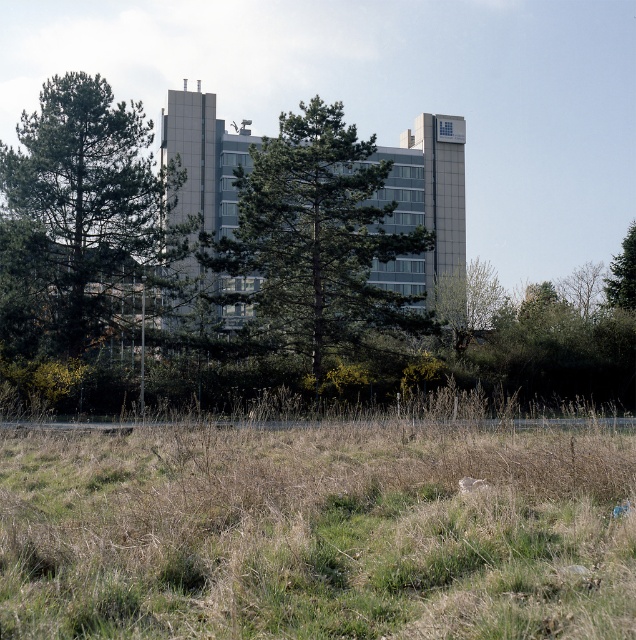
Question: Observing the image, what is the correct spatial positioning of green leafy tree at center in reference to green leafy tree at upper right?

Choices:
 (A) below
 (B) above

Answer: (B)

Question: Is green grass at lower center to the left of green leafy tree at upper right from the viewer's perspective?

Choices:
 (A) no
 (B) yes

Answer: (B)

Question: Which of the following is the farthest from the observer?

Choices:
 (A) green leafy tree at upper right
 (B) green leafy tree at center
 (C) green grass at lower center

Answer: (A)

Question: Is green matte tree at center positioned behind green leafy tree at center?

Choices:
 (A) yes
 (B) no

Answer: (B)

Question: Which object is the closest to the green grass at lower center?

Choices:
 (A) green leafy tree at upper right
 (B) green leafy tree at center
 (C) green matte tree at center

Answer: (C)

Question: Based on their relative distances, which object is nearer to the green grass at lower center?

Choices:
 (A) green leafy tree at center
 (B) green matte tree at center
 (C) green leafy tree at upper right

Answer: (B)